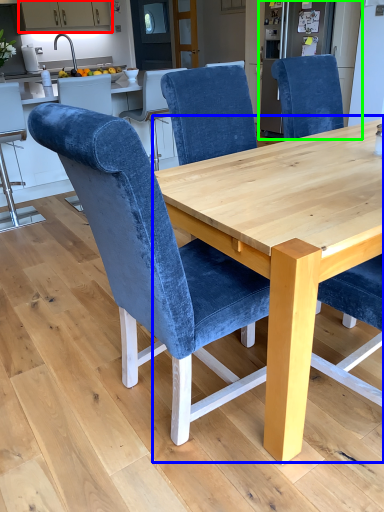
Question: Considering the real-world distances, which object is closest to cabinetry (highlighted by a red box)? round table (highlighted by a blue box) or appliance (highlighted by a green box).

Choices:
 (A) round table
 (B) appliance

Answer: (B)